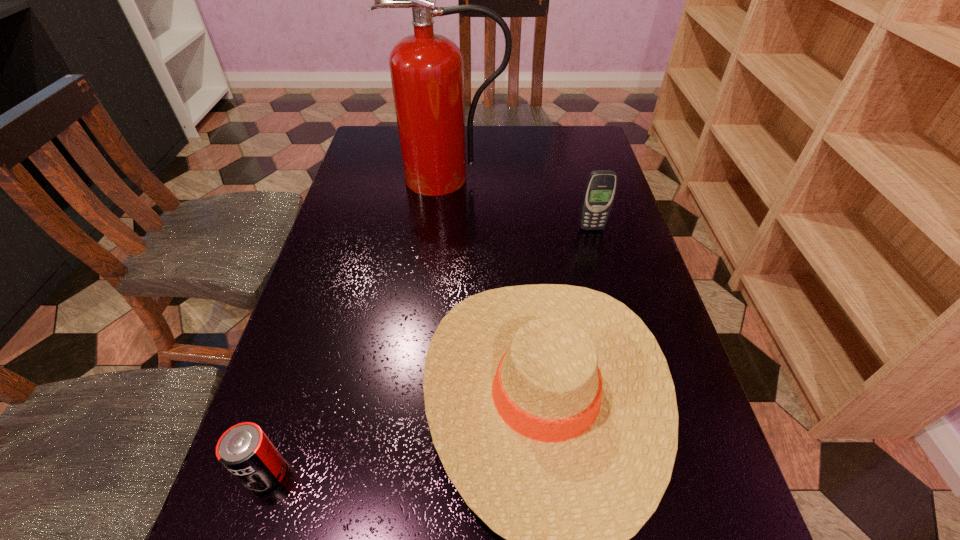
Image resolution: width=960 pixels, height=540 pixels. I want to click on free area in between the tallest object and the second tallest object, so click(x=520, y=203).

At what (x,y) coordinates should I click in order to perform the action: click on free spot between the third nearest object and the farthest object. Please return your answer as a coordinate pair (x, y). This screenshot has height=540, width=960. Looking at the image, I should click on (520, 203).

Identify which object is the third nearest to the sunhat. Please provide its 2D coordinates. Your answer should be formatted as a tuple, i.e. [(x, y)], where the tuple contains the x and y coordinates of a point satisfying the conditions above.

[(427, 73)]

The width and height of the screenshot is (960, 540). I want to click on object that is the closest to the third nearest object, so 552,408.